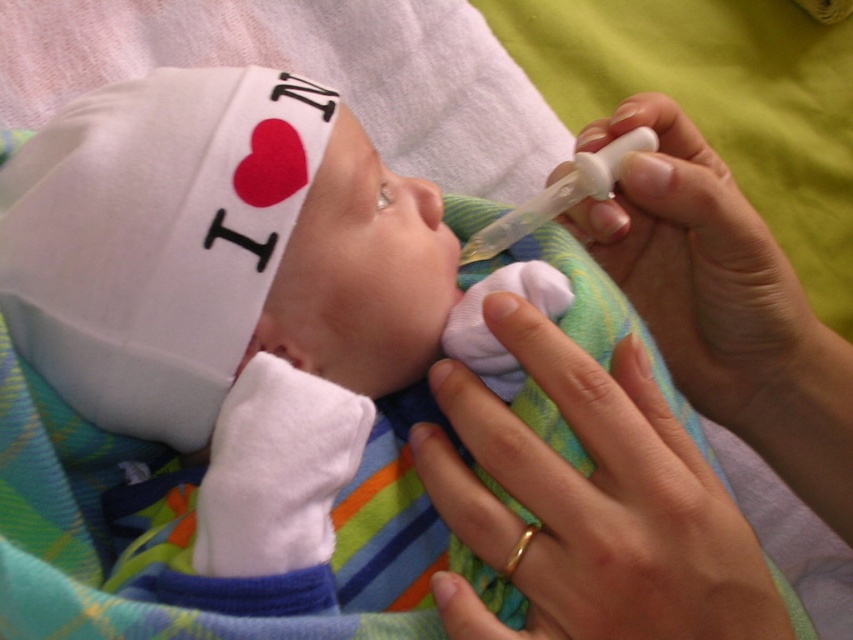
In the scene where a baby is being cared for, you see a white matte syringe at upper right and a smooth skin nose at center. Which object is positioned to the right side of the other?

The white matte syringe at upper right is to the right of smooth skin nose at center.

Based on the photo, you are a nurse preparing to administer eye drops to a baby. The baby has a smooth skin nose at center and you have a white plastic syringe at upper right. How far apart are these two items?

The white plastic syringe at upper right and the smooth skin nose at center are 2.50 inches apart.